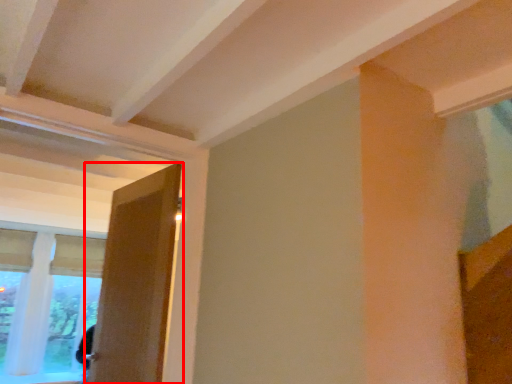
Question: From the image's perspective, considering the relative positions of door (annotated by the red box) and window in the image provided, where is door (annotated by the red box) located with respect to the staircase?

Choices:
 (A) below
 (B) above

Answer: (B)